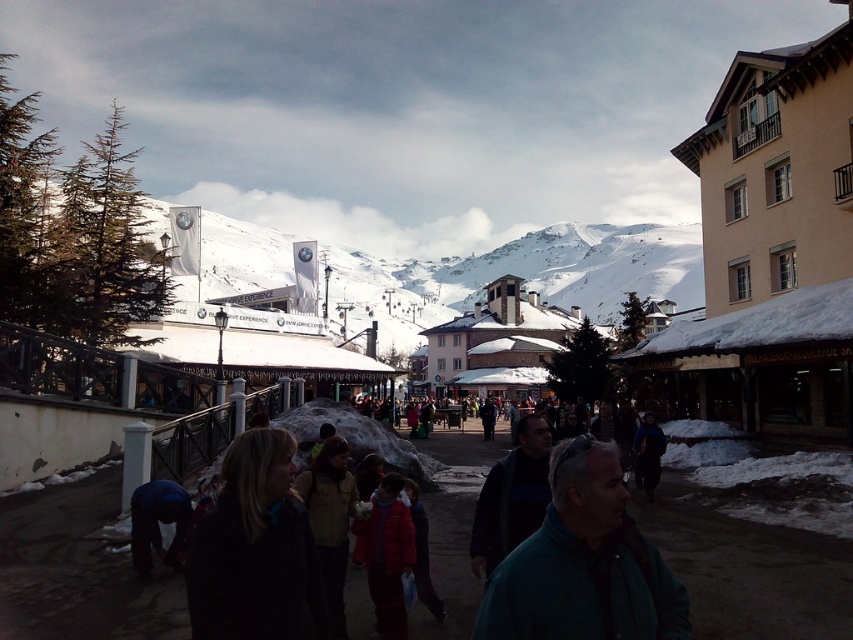
Does green matte jacket at center lie in front of snowy white mountain at center?

That is True.

How far apart are green matte jacket at center and snowy white mountain at center?

green matte jacket at center is 856.07 feet from snowy white mountain at center.

Which is in front, point (589, 557) or point (512, 252)?

Point (589, 557) is more forward.

Identify the location of green matte jacket at center. This screenshot has height=640, width=853. (584, 563).

Is green matte jacket at center taller than dark brown jacket at lower left?

No.

Does green matte jacket at center appear under dark brown jacket at lower left?

Yes.

Is point (546, 561) positioned in front of point (273, 547)?

Yes.

Locate an element on the screen. green matte jacket at center is located at coordinates (584, 563).

Can you confirm if dark brown jacket at lower left is positioned below snowy white mountain at center?

Yes, dark brown jacket at lower left is below snowy white mountain at center.

Is point (289, 513) farther from viewer compared to point (578, 280)?

That is False.

This screenshot has width=853, height=640. What are the coordinates of `dark brown jacket at lower left` in the screenshot? It's located at [254, 548].